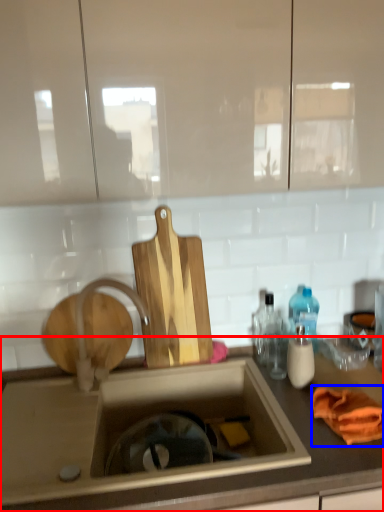
Question: Which point is further to the camera, countertop (highlighted by a red box) or material (highlighted by a blue box)?

Choices:
 (A) countertop
 (B) material

Answer: (B)